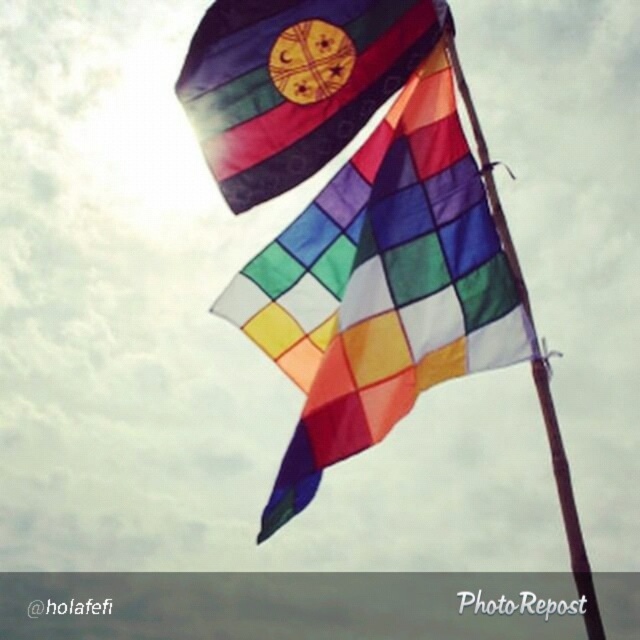
Is point (451, 349) positioned before point (584, 557)?

That is False.

Can you confirm if multicolored fabric kite at center is smaller than brown wooden pole at center?

No, multicolored fabric kite at center is not smaller than brown wooden pole at center.

Who is more forward, (490, 285) or (499, 205)?

Point (490, 285) is more forward.

This screenshot has width=640, height=640. In order to click on multicolored fabric kite at center in this screenshot , I will do `click(381, 285)`.

Which is more to the right, multicolored fabric kite at center or textured fabric flag at upper center?

From the viewer's perspective, multicolored fabric kite at center appears more on the right side.

Is point (504, 333) positioned after point (273, 140)?

That is False.

Find the location of a particular element. multicolored fabric kite at center is located at coordinates (381, 285).

Between textured fabric flag at upper center and brown wooden pole at center, which one appears on the left side from the viewer's perspective?

textured fabric flag at upper center is more to the left.

Which of these two, textured fabric flag at upper center or brown wooden pole at center, stands shorter?

With less height is textured fabric flag at upper center.

Which is in front, point (205, 99) or point (536, 376)?

Point (536, 376) is more forward.

Locate an element on the screen. textured fabric flag at upper center is located at coordinates (294, 83).